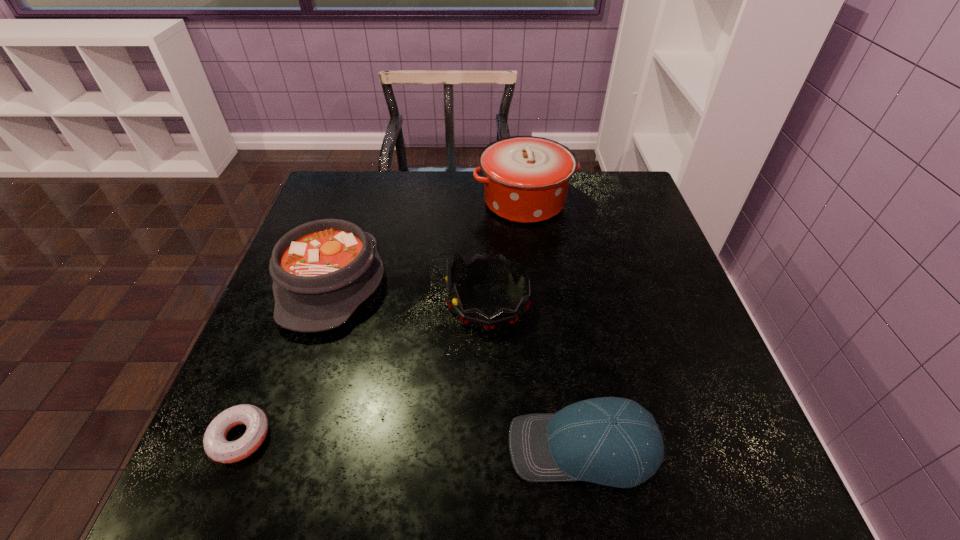
Locate an element on the screen. vacant area situated at the front of the tiara with jewels is located at coordinates click(x=286, y=301).

Where is `vacant area located on the back of the third shortest object`? This screenshot has height=540, width=960. vacant area located on the back of the third shortest object is located at coordinates (356, 208).

Locate an element on the screen. The width and height of the screenshot is (960, 540). vacant point located on the back of the second shortest object is located at coordinates (553, 268).

Where is `free point located 0.250m on the right of the doughnut`? The height and width of the screenshot is (540, 960). free point located 0.250m on the right of the doughnut is located at coordinates (411, 437).

The image size is (960, 540). I want to click on object positioned at the far edge, so click(x=526, y=178).

You are a GUI agent. You are given a task and a screenshot of the screen. Output one action in this format:
    pyautogui.click(x=<x>, y=<y>)
    Task: Click on the baseball cap situated at the near edge
    
    Given the screenshot: What is the action you would take?
    pyautogui.click(x=611, y=441)

Find the location of a particular element. The width and height of the screenshot is (960, 540). doughnut present at the near edge is located at coordinates (216, 446).

I want to click on casserole at the left edge, so click(322, 270).

This screenshot has width=960, height=540. Identify the location of doughnut that is at the left edge. (216, 446).

Identify the location of object that is at the near left corner. This screenshot has width=960, height=540. (216, 446).